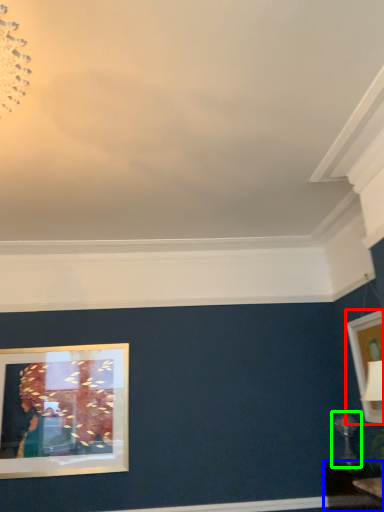
Question: Based on their relative distances, which object is nearer to picture frame (highlighted by a red box)? Choose from table (highlighted by a blue box) and table lamp (highlighted by a green box).

Choices:
 (A) table
 (B) table lamp

Answer: (B)